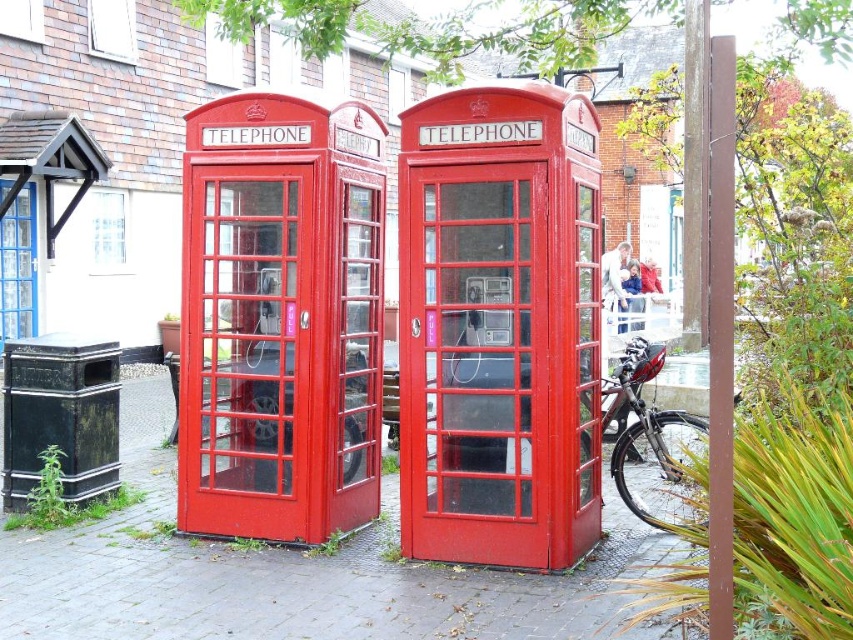
You are a delivery person trying to park your 2.5 feet wide delivery cart between the shiny black bicycle at center and the matte glass telephone booth at center. Can you fit your cart between them without moving either object?

The distance between the shiny black bicycle at center and the matte glass telephone booth at center is 4.71 feet. Since the cart is 2.5 feet wide, it can fit as there is enough space between them.

You are a delivery person trying to reach the matte glass telephone booth at center to drop off a package. There is a shiny black bicycle at center blocking the path. Can you easily access the booth without moving the bicycle?

The matte glass telephone booth at center is behind the shiny black bicycle at center, so you can still access the booth by going around the bicycle since it is positioned behind it.

You are a delivery person trying to park your shiny black bicycle at center near the matte glass telephone booth at center. Since both are at the center, which one should you move to make space?

The shiny black bicycle at center is larger in size than the matte glass telephone booth at center, so you should move the shiny black bicycle at center to make space.